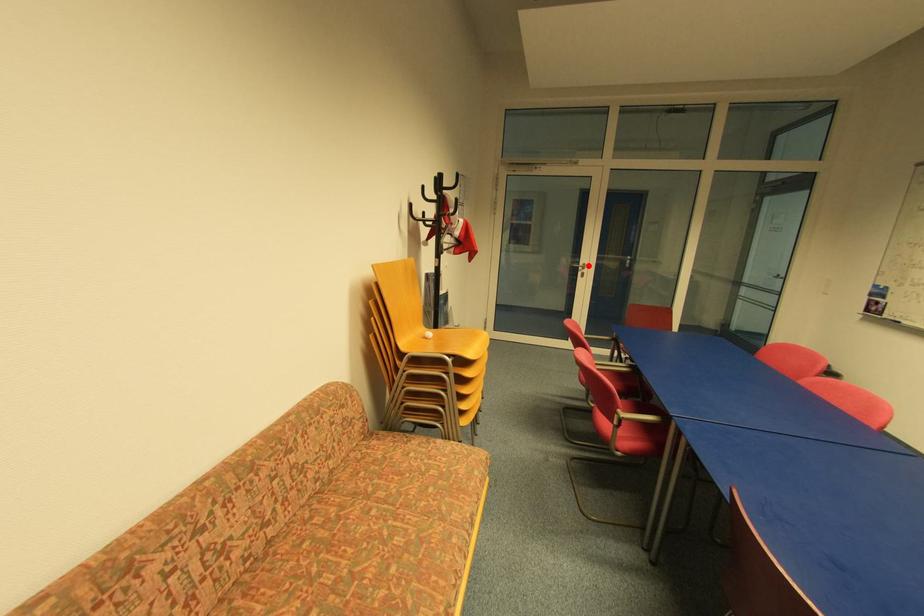
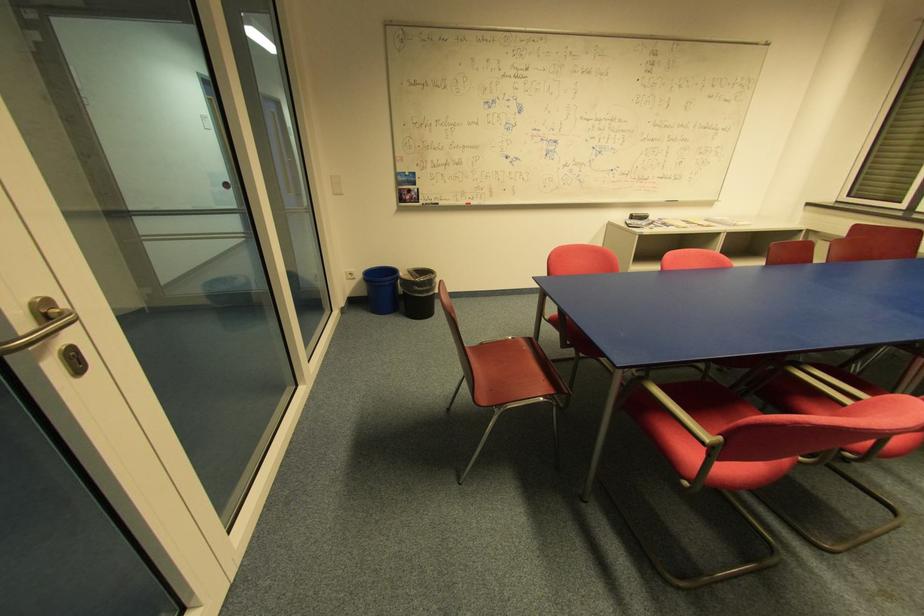
Question: I am providing you with two images of the same scene from different viewpoints. Image1 has a red point marked. In image2, the corresponding 3D location appears at what relative position? Reply with the corresponding letter.

Choices:
 (A) Closer
 (B) Farther

Answer: (B)